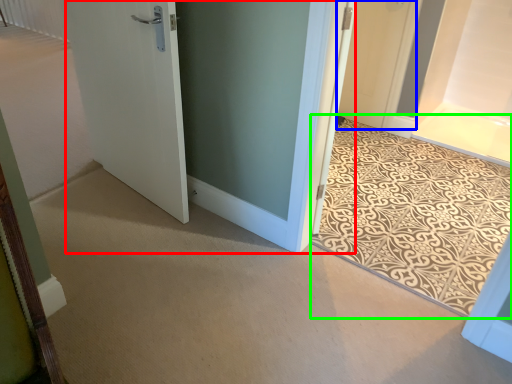
Question: Considering the real-world distances, which object is farthest from door (highlighted by a red box)? door (highlighted by a blue box) or doormat (highlighted by a green box)?

Choices:
 (A) door
 (B) doormat

Answer: (A)